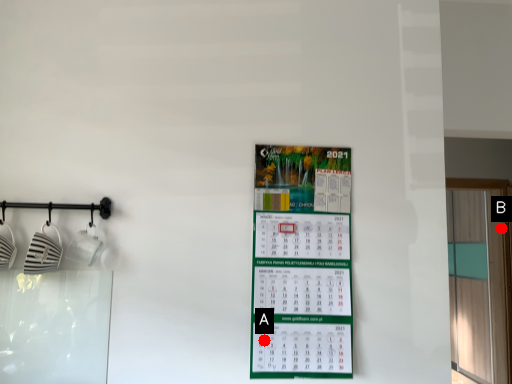
Question: Two points are circled on the image, labeled by A and B beside each circle. Among these points, which one is farthest from the camera?

Choices:
 (A) A is further
 (B) B is further

Answer: (B)